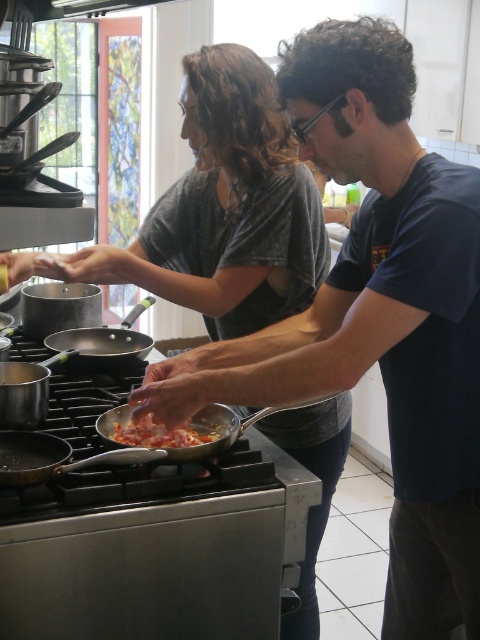
Is point (223, 378) positioned behind point (159, 432)?

No.

Which of these two, dark blue t-shirt at center or shiny metallic pan at center, stands taller?

Standing taller between the two is dark blue t-shirt at center.

The width and height of the screenshot is (480, 640). In order to click on dark blue t-shirt at center in this screenshot , I will do `click(376, 316)`.

In order to click on dark blue t-shirt at center in this screenshot , I will do `click(376, 316)`.

Between gold metallic frying pan at lower left and shiny metallic pan at center, which one has more height?

gold metallic frying pan at lower left

This screenshot has height=640, width=480. What do you see at coordinates (55, 458) in the screenshot?
I see `gold metallic frying pan at lower left` at bounding box center [55, 458].

I want to click on gold metallic frying pan at lower left, so click(x=55, y=458).

Who is taller, gold metallic frying pan at lower left or anodized aluminum wok at center?

anodized aluminum wok at center

Between point (52, 465) and point (84, 353), which one is positioned behind?

The point (84, 353) is more distant.

At what (x,y) coordinates should I click in order to perform the action: click on gold metallic frying pan at lower left. Please return your answer as a coordinate pair (x, y). The width and height of the screenshot is (480, 640). Looking at the image, I should click on (55, 458).